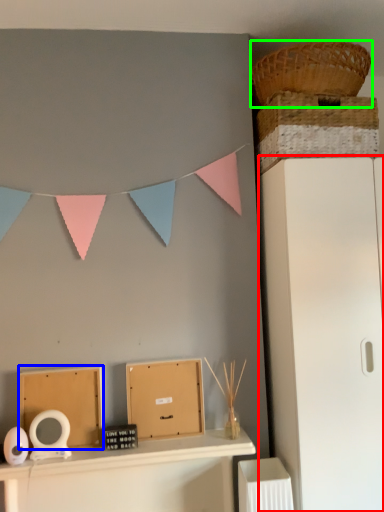
Question: Based on their relative distances, which object is farther from file cabinet (highlighted by a red box)? Choose from cardboard box (highlighted by a blue box) and basket (highlighted by a green box).

Choices:
 (A) cardboard box
 (B) basket

Answer: (A)